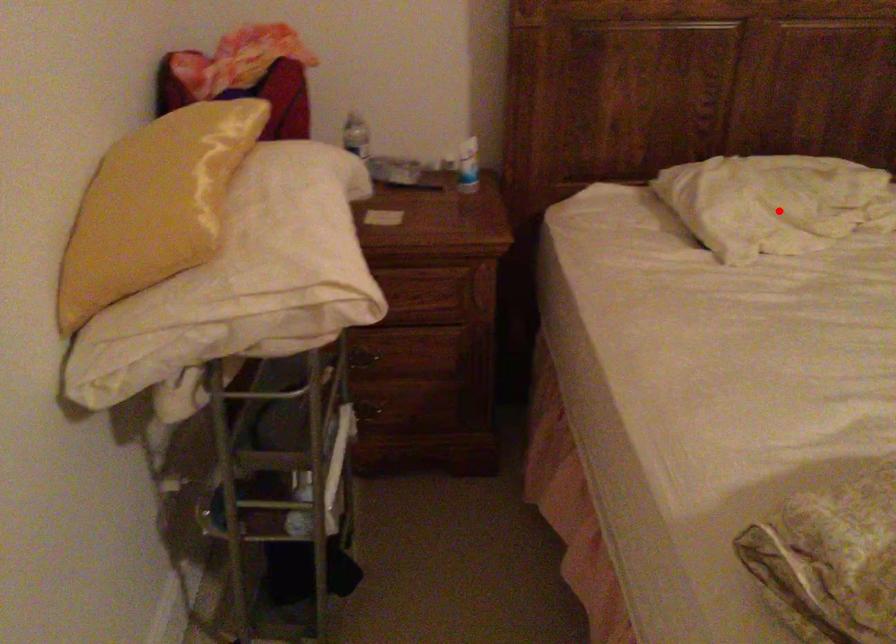
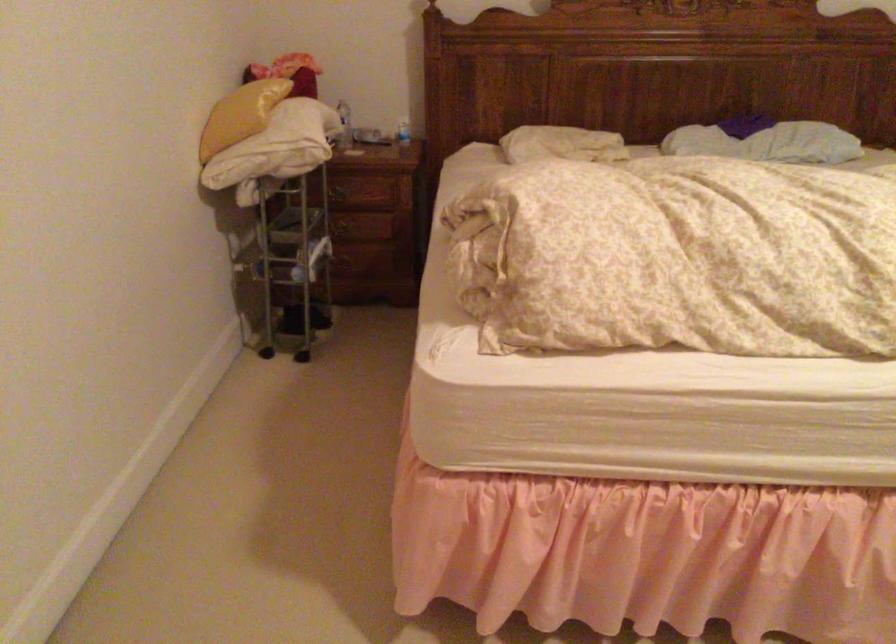
Locate, in the second image, the point that corresponds to the highlighted location in the first image.

(561, 144)